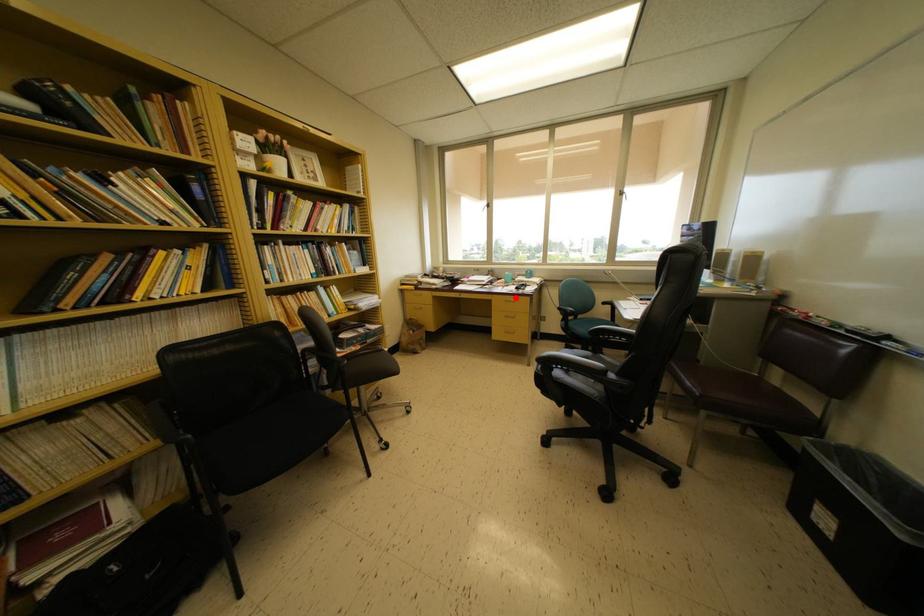
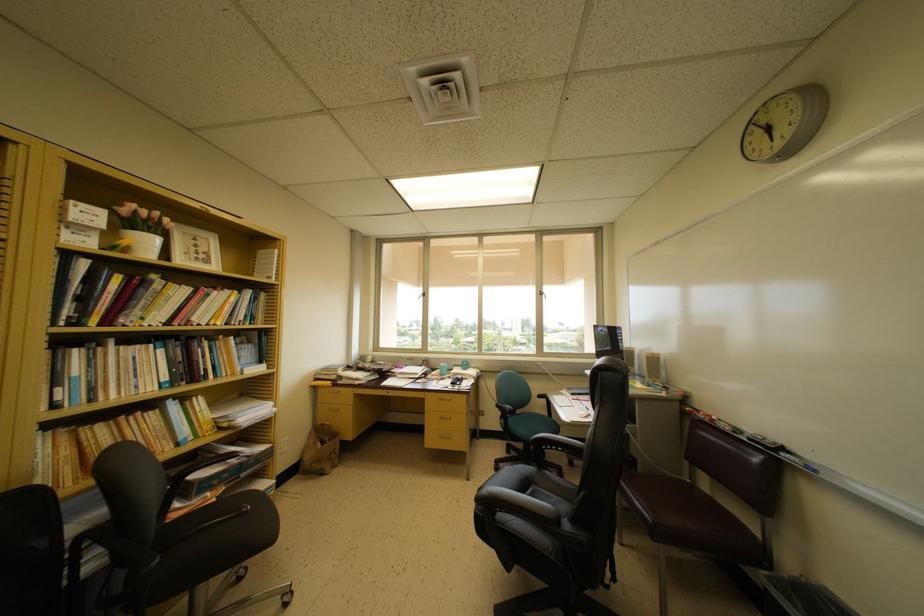
Where in the second image is the point corresponding to the highlighted location from the first image?

(451, 394)